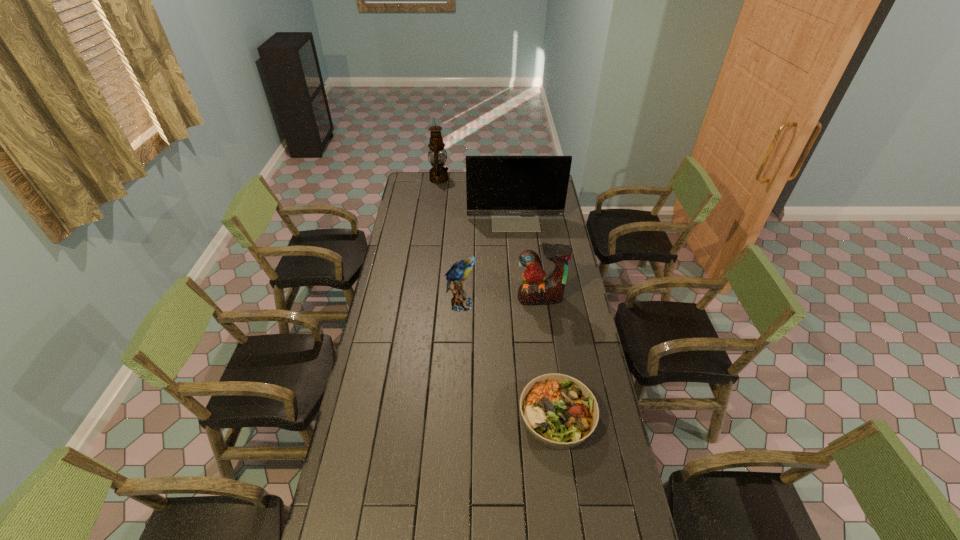
Locate an element on the screen. free space that satisfies the following two spatial constraints: 1. at the face of the right parrot; 2. on the face of the left parrot is located at coordinates (541, 304).

You are a GUI agent. You are given a task and a screenshot of the screen. Output one action in this format:
    pyautogui.click(x=<x>, y=<y>)
    Task: Click on the free point that satisfies the following two spatial constraints: 1. on the screen of the shortest object; 2. on the right side of the second farthest object
    This screenshot has width=960, height=540.
    Given the screenshot: What is the action you would take?
    pyautogui.click(x=535, y=417)

Find the location of a particular element. Image resolution: width=960 pixels, height=540 pixels. free space in the image that satisfies the following two spatial constraints: 1. on the screen of the computer monitor; 2. on the face of the left parrot is located at coordinates click(523, 304).